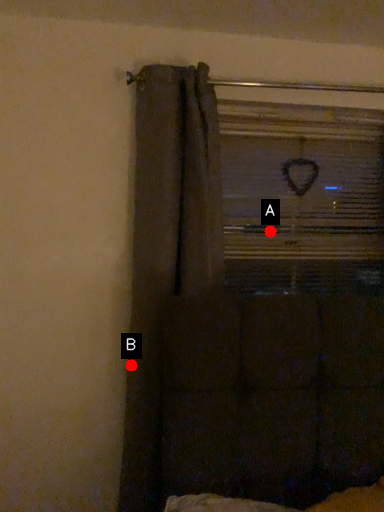
Question: Two points are circled on the image, labeled by A and B beside each circle. Which point is closer to the camera?

Choices:
 (A) A is closer
 (B) B is closer

Answer: (B)